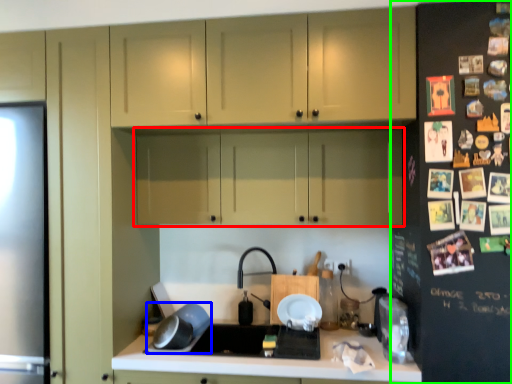
Question: Considering the real-world distances, which object is closest to cabinetry (highlighted by a red box)? appliance (highlighted by a blue box) or fridge (highlighted by a green box).

Choices:
 (A) appliance
 (B) fridge

Answer: (B)